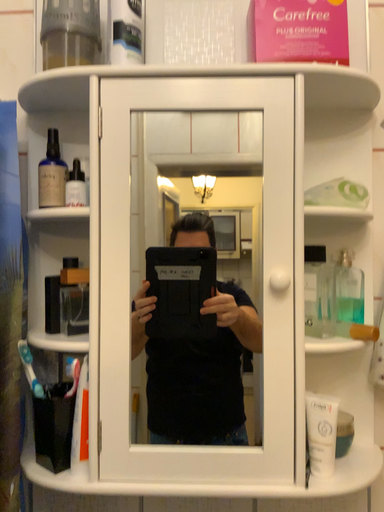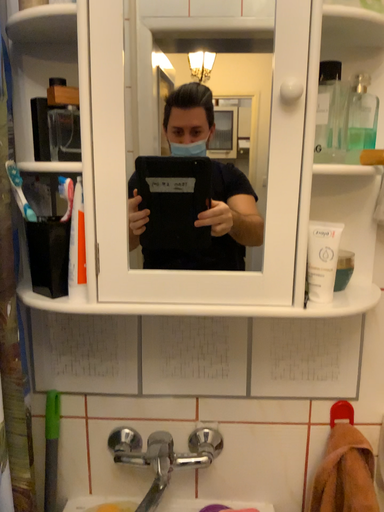
Question: Which way did the camera rotate in the video?

Choices:
 (A) rotated upward
 (B) rotated downward

Answer: (B)